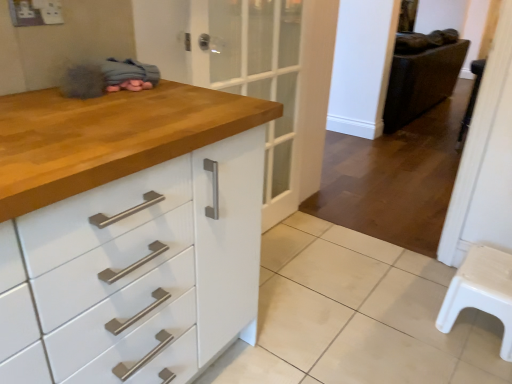
This screenshot has width=512, height=384. Find the location of `vacant area on top of white glossy tile at lower center (from a real-world perspective)`. vacant area on top of white glossy tile at lower center (from a real-world perspective) is located at coordinates (342, 309).